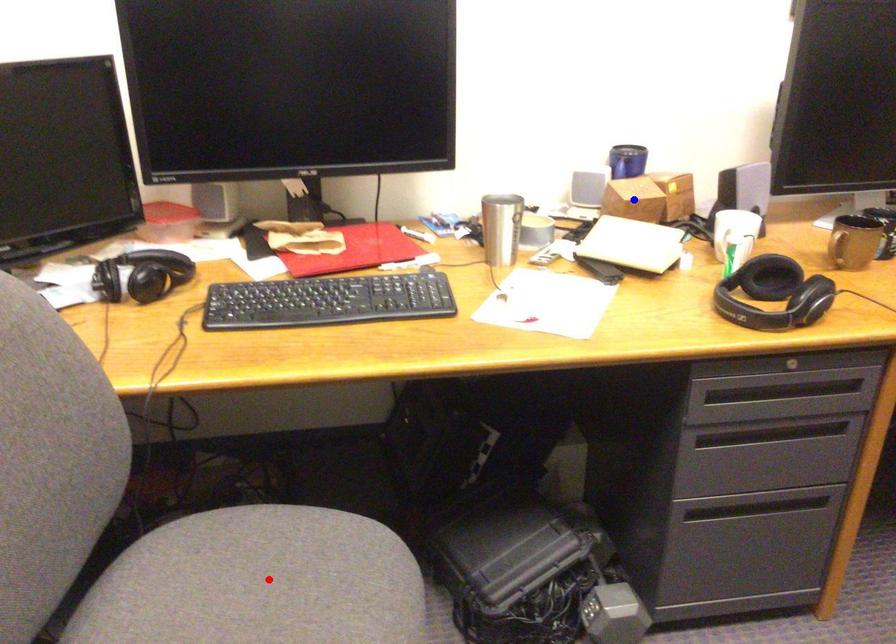
Question: Two points are marked on the image. Which point is closer to the camera?

Choices:
 (A) Blue point is closer.
 (B) Red point is closer.

Answer: (B)